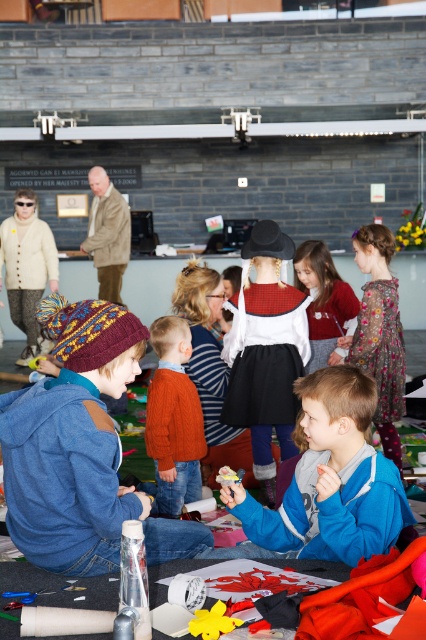
Question: In this image, where is blue fleece jacket at center located relative to velvet red sweater at center?

Choices:
 (A) left
 (B) right

Answer: (A)

Question: Is knitted woolen hat at lower left thinner than velvet red sweater at center?

Choices:
 (A) no
 (B) yes

Answer: (A)

Question: Which of the following is the farthest from the observer?

Choices:
 (A) (354, 307)
 (B) (80, 301)
 (C) (164, 406)
 (D) (267, 531)

Answer: (A)

Question: Can you confirm if orange knitted sweater at center is positioned below velvet red sweater at center?

Choices:
 (A) yes
 (B) no

Answer: (A)

Question: Considering the real-world distances, which object is farthest from the blue fleece jacket at center?

Choices:
 (A) orange knitted sweater at center
 (B) velvet red sweater at center
 (C) knitted woolen hat at lower left

Answer: (B)

Question: Among these objects, which one is nearest to the camera?

Choices:
 (A) knitted woolen hat at lower left
 (B) velvet red sweater at center

Answer: (A)